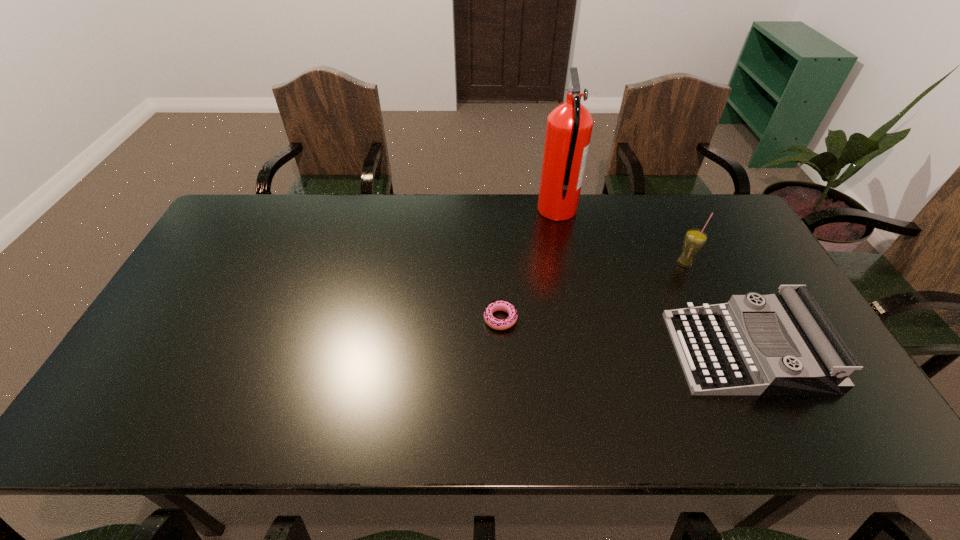
This screenshot has width=960, height=540. I want to click on vacant space that's between the third tallest object and the leftmost object, so [x=623, y=335].

Locate which object is the second closest to the second shortest object. Please provide its 2D coordinates. Your answer should be formatted as a tuple, i.e. [(x, y)], where the tuple contains the x and y coordinates of a point satisfying the conditions above.

[(502, 305)]

Where is `object that is the closest to the straw for drinking`? This screenshot has height=540, width=960. object that is the closest to the straw for drinking is located at coordinates (779, 344).

Where is `vacant space that satisfies the following two spatial constraints: 1. at the nozzle of the second farthest object; 2. on the left side of the farthest object`? vacant space that satisfies the following two spatial constraints: 1. at the nozzle of the second farthest object; 2. on the left side of the farthest object is located at coordinates (567, 263).

The width and height of the screenshot is (960, 540). Find the location of `vacant area that satisfies the following two spatial constraints: 1. at the nozzle of the tallest object; 2. on the right side of the third nearest object`. vacant area that satisfies the following two spatial constraints: 1. at the nozzle of the tallest object; 2. on the right side of the third nearest object is located at coordinates (567, 263).

Where is `vacant point that satisfies the following two spatial constraints: 1. on the back side of the third shortest object; 2. on the left side of the leftmost object`? This screenshot has height=540, width=960. vacant point that satisfies the following two spatial constraints: 1. on the back side of the third shortest object; 2. on the left side of the leftmost object is located at coordinates (498, 263).

Find the location of `vacant region that satisfies the following two spatial constraints: 1. on the back side of the straw for drinking; 2. at the nozzle of the third object from right to left`. vacant region that satisfies the following two spatial constraints: 1. on the back side of the straw for drinking; 2. at the nozzle of the third object from right to left is located at coordinates (660, 211).